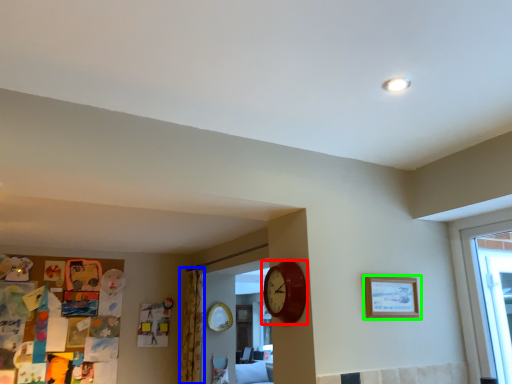
Question: Based on their relative distances, which object is farther from wall clock (highlighted by a red box)? Choose from curtain (highlighted by a blue box) and picture frame (highlighted by a green box).

Choices:
 (A) curtain
 (B) picture frame

Answer: (A)